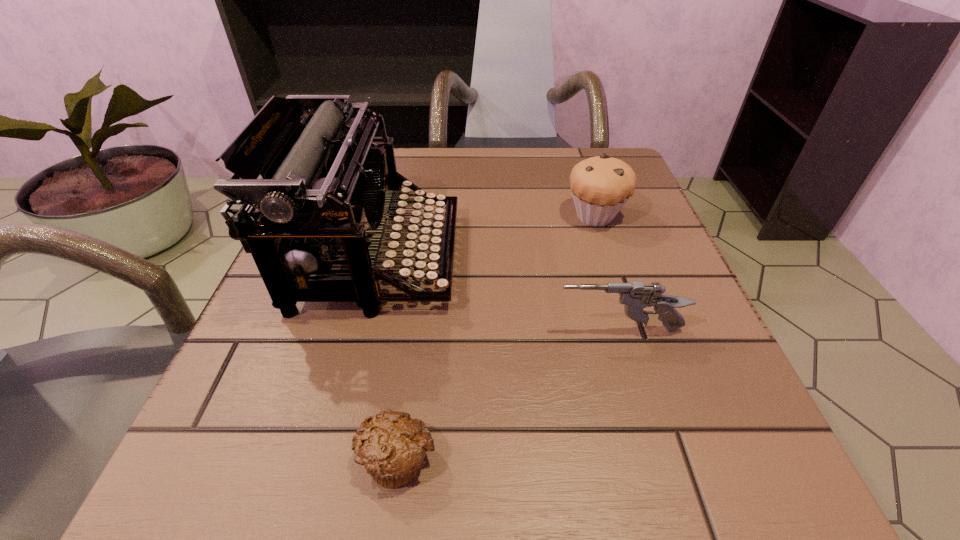
You are a GUI agent. You are given a task and a screenshot of the screen. Output one action in this format:
    pyautogui.click(x=<x>, y=<y>)
    Task: Click on the free space located 0.090m at the barrel of the third tallest object
    Image resolution: width=960 pixels, height=540 pixels.
    Given the screenshot: What is the action you would take?
    pyautogui.click(x=494, y=330)

Locate an element on the screen. Image resolution: width=960 pixels, height=540 pixels. vacant space located 0.200m on the right of the nearest object is located at coordinates (611, 457).

At what (x,y) coordinates should I click in order to perform the action: click on object located at the far edge. Please return your answer as a coordinate pair (x, y). This screenshot has height=540, width=960. Looking at the image, I should click on (601, 185).

Locate an element on the screen. The height and width of the screenshot is (540, 960). object that is positioned at the near edge is located at coordinates (391, 447).

I want to click on object that is at the left edge, so click(322, 190).

This screenshot has height=540, width=960. I want to click on muffin that is at the right edge, so click(601, 185).

Where is `gun that is at the right edge`? gun that is at the right edge is located at coordinates (636, 296).

Identify the location of object situated at the far right corner. (601, 185).

Where is `free location at the far edge of the desktop`? This screenshot has height=540, width=960. free location at the far edge of the desktop is located at coordinates (407, 154).

In the image, there is a desktop. What are the coordinates of `vacant space at the near edge` in the screenshot? It's located at (352, 509).